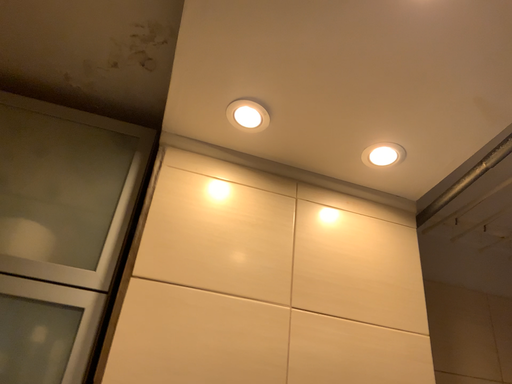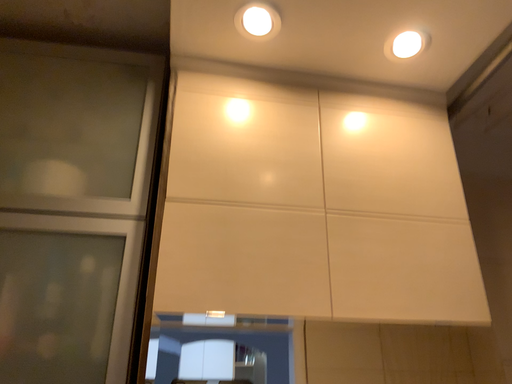
Question: How did the camera likely rotate when shooting the video?

Choices:
 (A) rotated upward
 (B) rotated downward

Answer: (B)